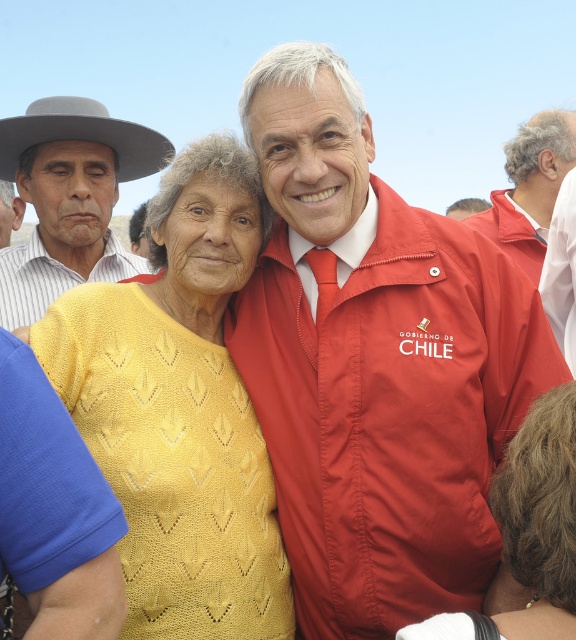
Question: In this image, where is yellow knitted sweater at center located relative to red fabric jacket at center?

Choices:
 (A) left
 (B) right

Answer: (A)

Question: Considering the relative positions of yellow knitted sweater at center and red fabric jacket at center in the image provided, where is yellow knitted sweater at center located with respect to red fabric jacket at center?

Choices:
 (A) above
 (B) below

Answer: (B)

Question: Considering the relative positions of yellow knit sweater at center and red fabric jacket at center in the image provided, where is yellow knit sweater at center located with respect to red fabric jacket at center?

Choices:
 (A) below
 (B) above

Answer: (A)

Question: Which of these objects is positioned closest to the yellow knit sweater at center?

Choices:
 (A) matte gray hat at left
 (B) matte red jacket at center
 (C) yellow knitted sweater at center
 (D) matte white shirt at left

Answer: (B)

Question: Which of the following is the farthest from the observer?

Choices:
 (A) yellow knit sweater at center
 (B) matte red jacket at center
 (C) yellow knitted sweater at center
 (D) matte white shirt at left

Answer: (D)

Question: Estimate the real-world distances between objects in this image. Which object is farther from the red fabric jacket at center?

Choices:
 (A) yellow knitted sweater at center
 (B) matte gray hat at left
 (C) matte white shirt at left

Answer: (C)